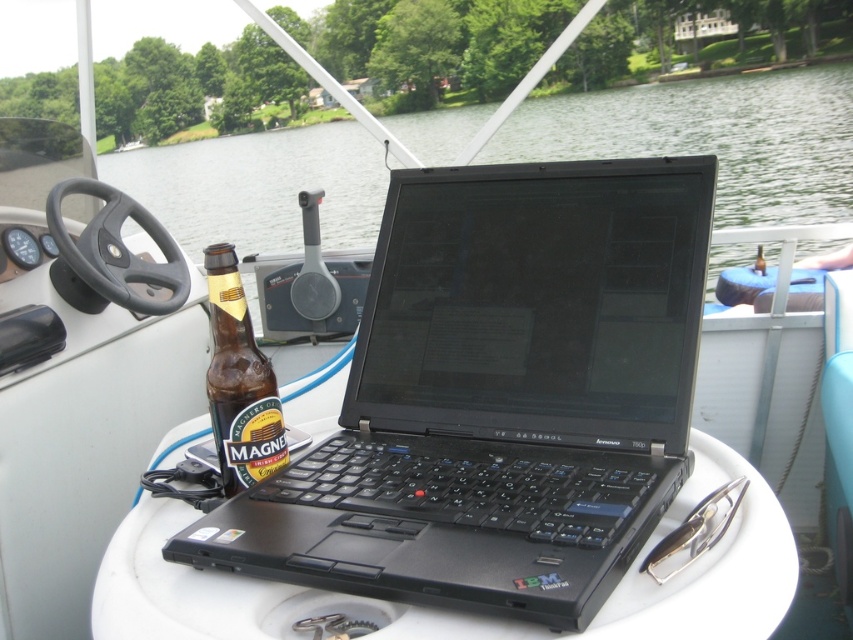
From the picture: You are a passenger on a boat and want to place a 1.5 meter long fishing rod on the white plastic table at center. Considering the space between the clear water at center and the table, will the rod fit on the table without hanging over the edge?

The clear water at center is 4.62 meters away from the white plastic table at center. Since the fishing rod is only 1.5 meters long, it will fit comfortably on the table without overhanging the edges.

You are on a boat and want to drink water. Where is the clear water at center located?

The clear water at center is located at point (712,138).

You are a passenger on a boat and want to place a small item between the clear water at center and the brown glass bottle at center. Is there enough space between them for the item?

The clear water at center is to the left of brown glass bottle at center, so there is space between them for the item.